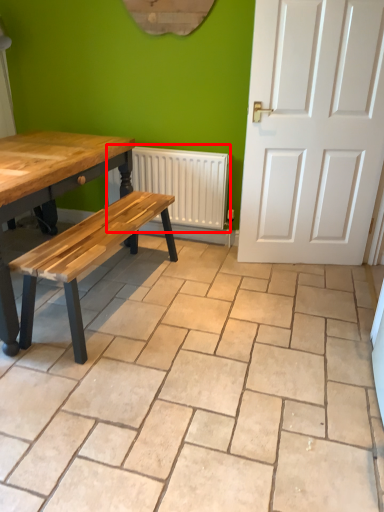
Question: Where is radiator (annotated by the red box) located in relation to ceramic tile in the image?

Choices:
 (A) left
 (B) right

Answer: (B)